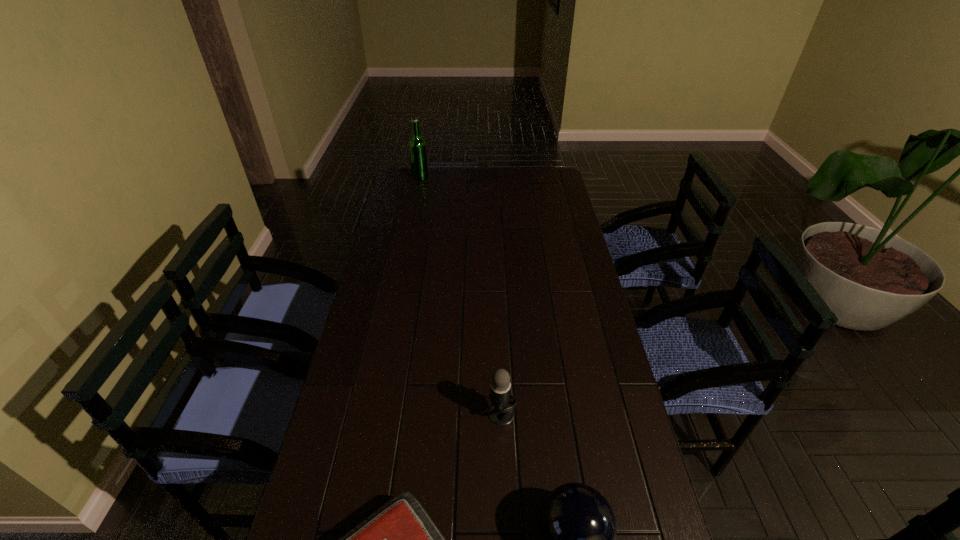
The image size is (960, 540). In order to click on blank space at the right edge of the desktop in this screenshot , I will do `click(542, 199)`.

The width and height of the screenshot is (960, 540). Find the location of `free location at the far left corner`. free location at the far left corner is located at coordinates (431, 171).

This screenshot has height=540, width=960. What are the coordinates of `unoccupied area between the farthest object and the microphone` in the screenshot? It's located at (461, 296).

The width and height of the screenshot is (960, 540). Find the location of `object that is the closest to the bowling ball`. object that is the closest to the bowling ball is located at coordinates (399, 539).

The height and width of the screenshot is (540, 960). In order to click on object that stands as the closest to the first-aid kit in this screenshot , I will do `click(577, 524)`.